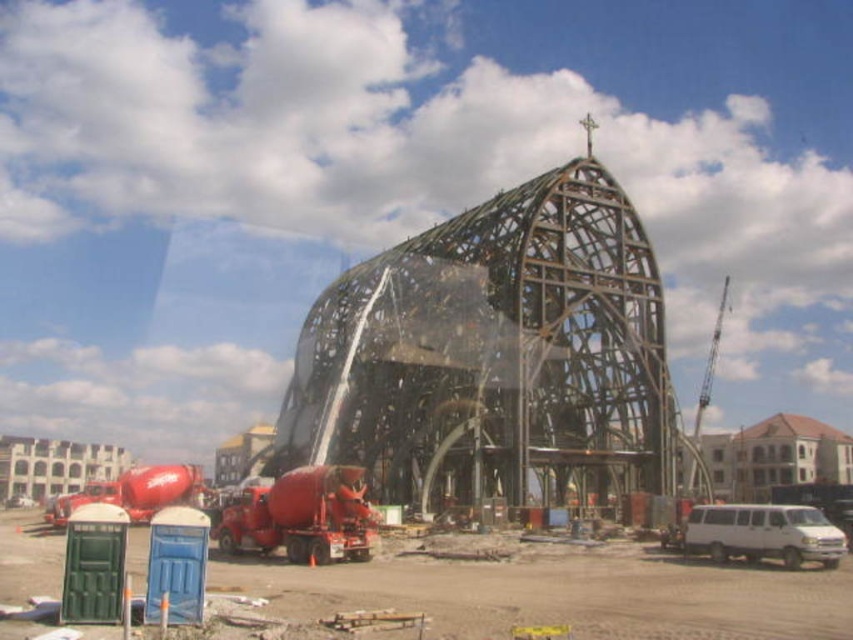
Between green plastic port-a-potty at lower left and white matte van at lower right, which one is positioned lower?

white matte van at lower right is lower down.

Is green plastic port-a-potty at lower left to the left of white matte van at lower right from the viewer's perspective?

Indeed, green plastic port-a-potty at lower left is positioned on the left side of white matte van at lower right.

Does point (254, 560) lie behind point (791, 556)?

Yes, it is behind point (791, 556).

You are a GUI agent. You are given a task and a screenshot of the screen. Output one action in this format:
    pyautogui.click(x=<x>, y=<y>)
    Task: Click on the green plastic port-a-potty at lower left
    
    Given the screenshot: What is the action you would take?
    pyautogui.click(x=561, y=593)

Between point (646, 472) and point (796, 548), which one is positioned in front?

Positioned in front is point (796, 548).

Does metallic framework at center appear over white matte van at lower right?

Correct, metallic framework at center is located above white matte van at lower right.

Locate an element on the screen. This screenshot has height=640, width=853. metallic framework at center is located at coordinates (496, 356).

Where is `metallic framework at center`? The height and width of the screenshot is (640, 853). metallic framework at center is located at coordinates (496, 356).

Does metallic framework at center lie behind green plastic port-a-potty at lower left?

Yes, metallic framework at center is further from the viewer.

In the scene shown: Can you confirm if metallic framework at center is shorter than green plastic port-a-potty at lower left?

Incorrect, metallic framework at center's height does not fall short of green plastic port-a-potty at lower left's.

Identify the location of metallic framework at center. The height and width of the screenshot is (640, 853). (496, 356).